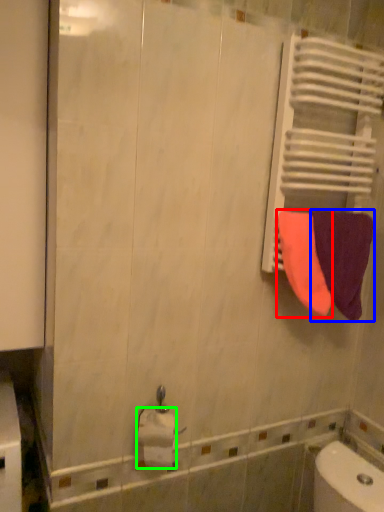
Question: Considering the real-world distances, which object is farthest from towel (highlighted by a red box)? towel (highlighted by a blue box) or toilet paper (highlighted by a green box)?

Choices:
 (A) towel
 (B) toilet paper

Answer: (B)